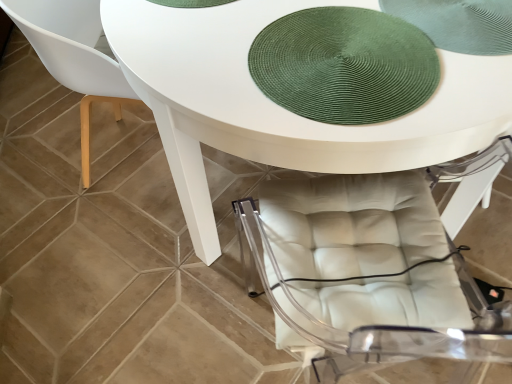
The height and width of the screenshot is (384, 512). I want to click on vacant area that is situated to the right of green woven mat at upper center, so click(472, 50).